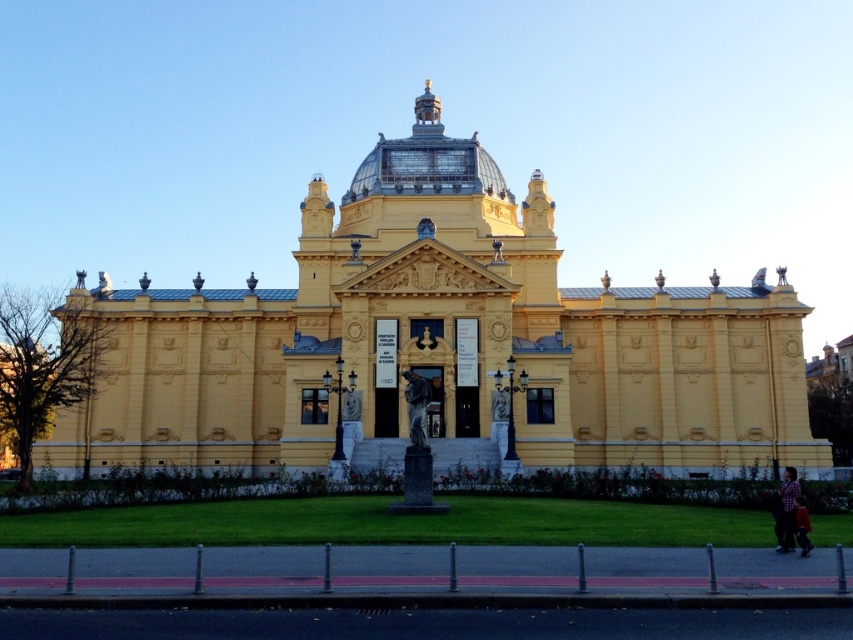
You are an art student who wants to sketch the bronze statue at center and the plaid shirt at lower right. Which object should you choose if you want to draw something wider?

The plaid shirt at lower right is wider than the bronze statue at center, so you should choose the plaid shirt at lower right.

You are a visitor standing at the entrance of the grand yellow building and notice two items at the lower right corner of the scene. You want to pick up both the plaid shirt at lower right and the dark brown leather jacket at lower right. If you can carry both items in one trip, how far apart are they from each other?

The plaid shirt at lower right and dark brown leather jacket at lower right are 6.13 meters apart from each other, so you can carry both items in one trip since they are within a reasonable distance.

You are standing in front of the grand yellow building and want to take a photo. You notice two points marked on the building at coordinates point (570,449) and point (793,492). Which point is closer to your camera when taking the photo?

Point (570,449) is closer to the camera than point (793,492) because it is further to the camera than the other point.